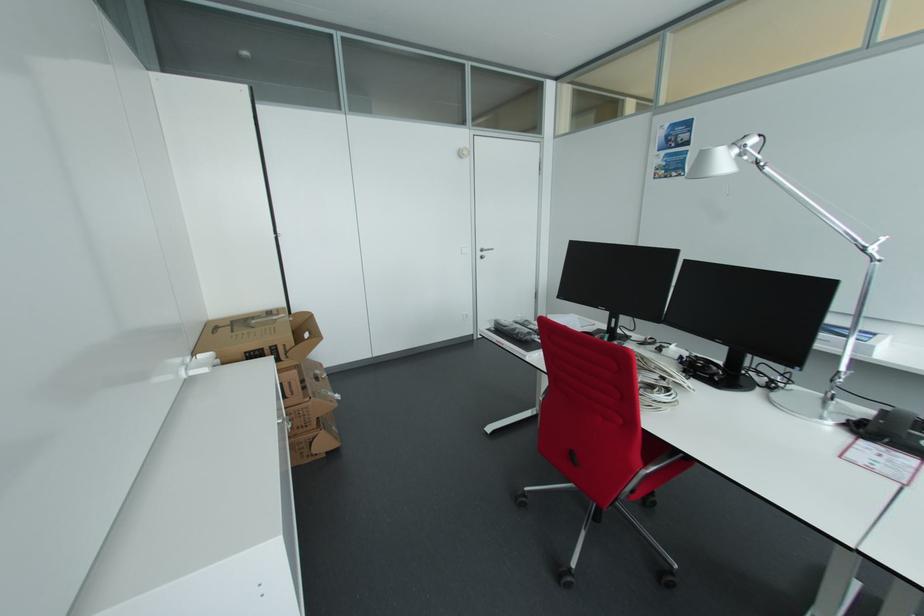
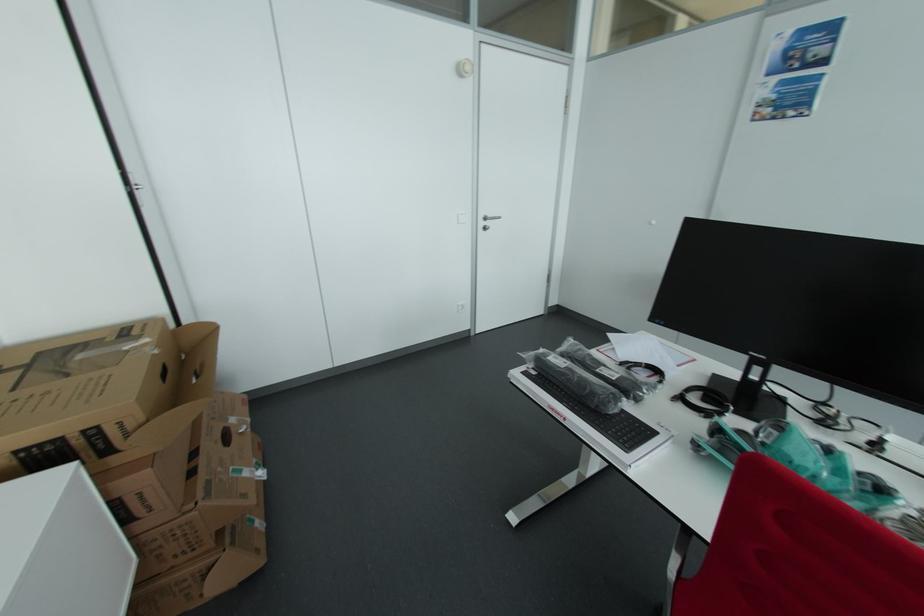
Question: Based on the continuous images, in which direction is the camera rotating? Reply with the corresponding letter.

Choices:
 (A) Left
 (B) Right
 (C) Up
 (D) Down

Answer: (D)